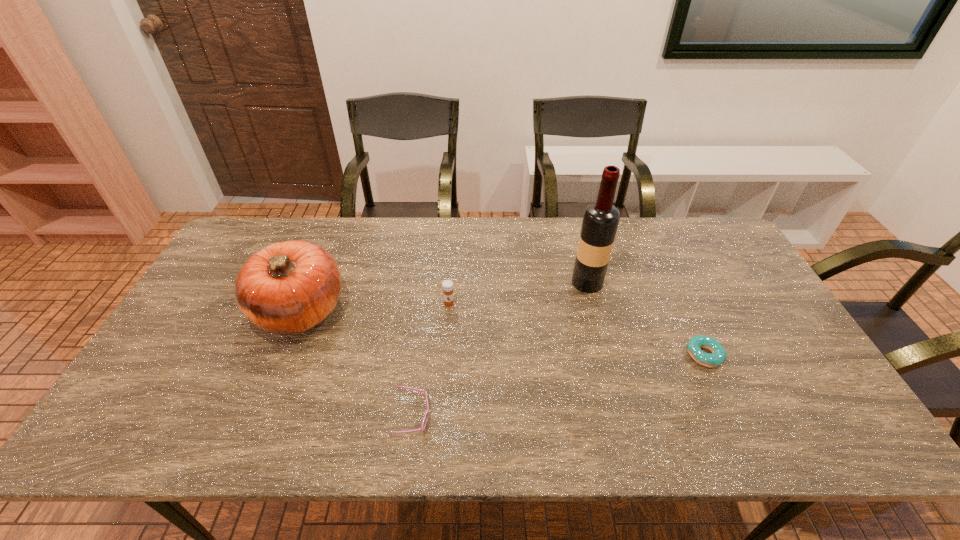
Where is `vacant space that satisfies the following two spatial constraints: 1. on the front side of the doughnut; 2. on the left side of the wine bottle`? This screenshot has height=540, width=960. vacant space that satisfies the following two spatial constraints: 1. on the front side of the doughnut; 2. on the left side of the wine bottle is located at coordinates (606, 355).

The image size is (960, 540). I want to click on free location that satisfies the following two spatial constraints: 1. on the back side of the fourth object from left to right; 2. on the right side of the second tallest object, so click(311, 282).

The height and width of the screenshot is (540, 960). In order to click on free space that satisfies the following two spatial constraints: 1. on the front side of the doughnut; 2. on the right side of the fourth shortest object in this screenshot , I will do `click(281, 355)`.